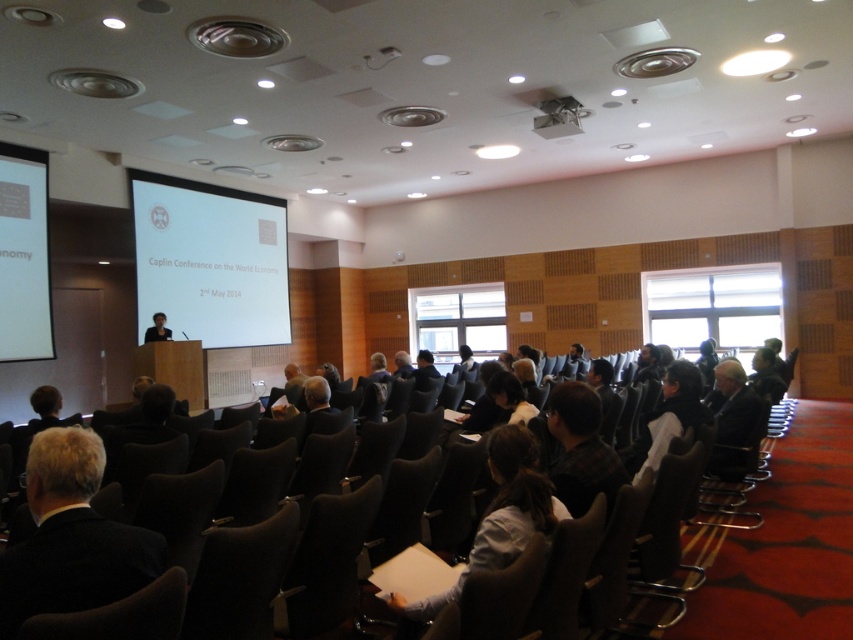
Question: From the image, what is the correct spatial relationship of gray fabric suit at lower left in relation to white glossy projector screen at left?

Choices:
 (A) right
 (B) left

Answer: (A)

Question: Estimate the real-world distances between objects in this image. Which object is farther from the gray fabric suit at lower left?

Choices:
 (A) white glossy projector screen at center
 (B) light blue shirt at center
 (C) black leather chair at center
 (D) black fabric person at center

Answer: (A)

Question: Is white glossy projector screen at center positioned at the back of gray fabric suit at lower left?

Choices:
 (A) yes
 (B) no

Answer: (A)

Question: Which point is farther from the camera taking this photo?

Choices:
 (A) (126, 576)
 (B) (3, 179)
 (C) (503, 438)

Answer: (B)

Question: Which is nearer to the light blue shirt at center?

Choices:
 (A) gray fabric suit at lower left
 (B) white glossy projector screen at center
 (C) white glossy projector screen at left

Answer: (A)

Question: Is white glossy projector screen at center to the left of black leather chair at center from the viewer's perspective?

Choices:
 (A) yes
 (B) no

Answer: (A)